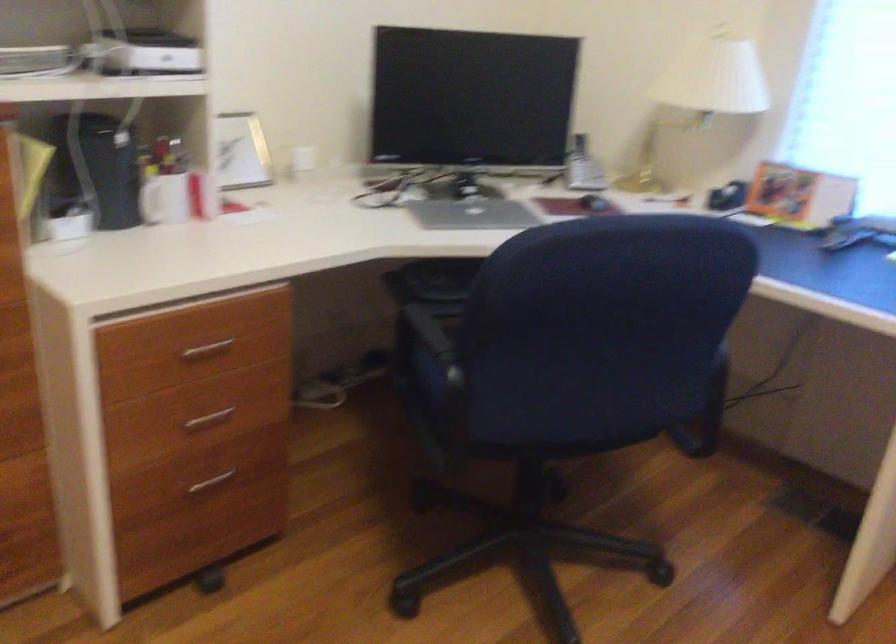
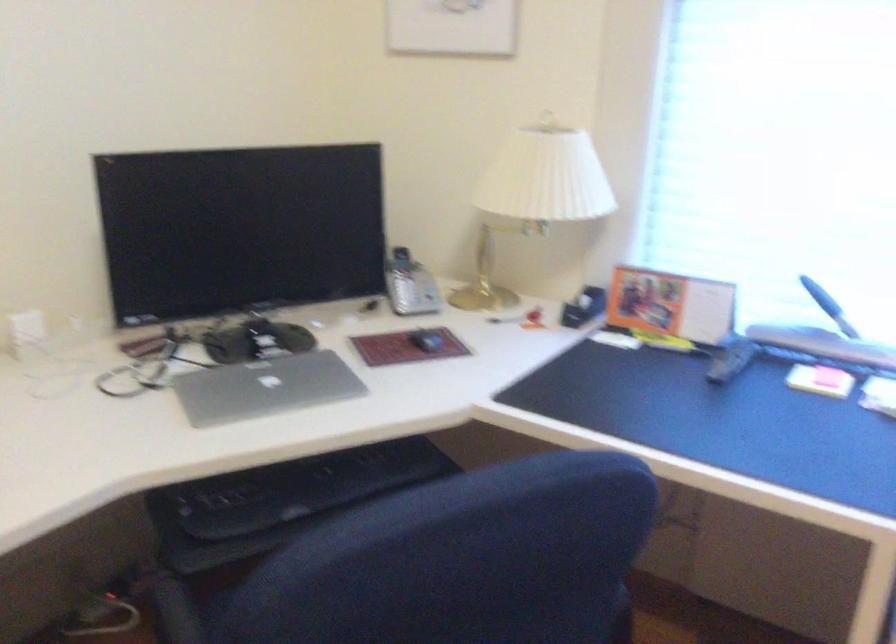
Locate, in the second image, the point that corresponds to point (659, 198) in the first image.

(504, 319)